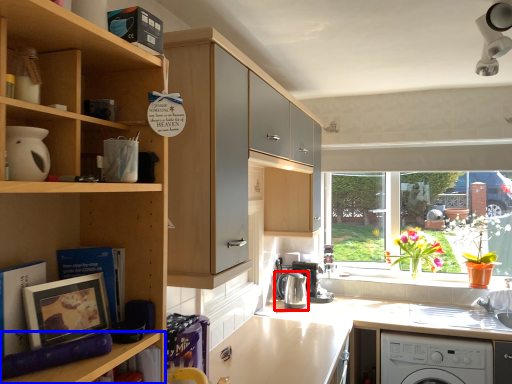
Question: Which of the following is the farthest to the observer, kitchen appliance (highlighted by a red box) or shelf (highlighted by a blue box)?

Choices:
 (A) kitchen appliance
 (B) shelf

Answer: (A)